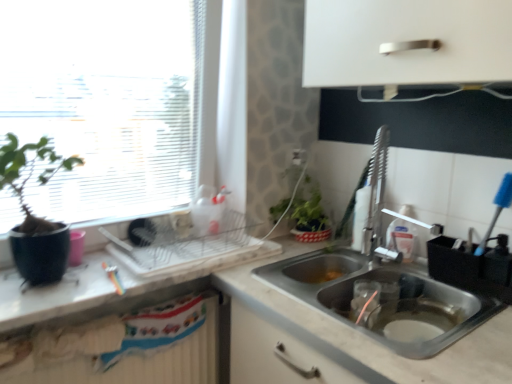
Identify the location of free space above white textured radiator at lower left (from a real-world perspective). This screenshot has height=384, width=512. (103, 317).